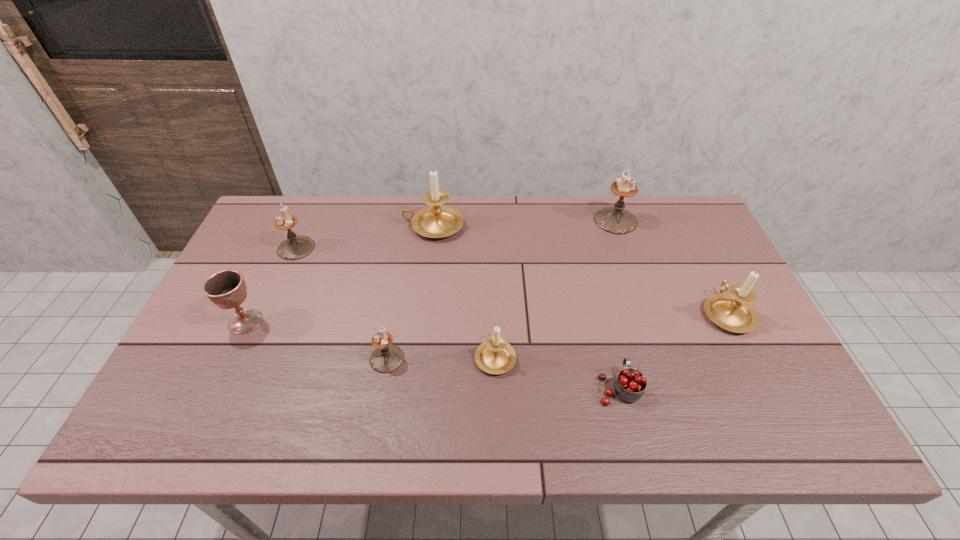
This screenshot has height=540, width=960. In order to click on the second object from right to left in this screenshot , I will do 616,220.

Locate an element on the screen. This screenshot has height=540, width=960. the fifth candle holder from left to right is located at coordinates (616, 220).

At what (x,y) coordinates should I click in order to perform the action: click on the leftmost beige candle holder. Please return your answer as a coordinate pair (x, y). Image resolution: width=960 pixels, height=540 pixels. Looking at the image, I should click on (437, 221).

This screenshot has height=540, width=960. I want to click on the farthest beige candle holder, so click(x=437, y=221).

Find the location of a particular element. This screenshot has width=960, height=540. the second nearest purple candle holder is located at coordinates (295, 247).

Locate an element on the screen. the second biggest purple candle holder is located at coordinates (295, 247).

The height and width of the screenshot is (540, 960). In order to click on the second smallest beige candle holder in this screenshot , I will do `click(732, 312)`.

This screenshot has width=960, height=540. Find the location of `the rightmost candle holder`. the rightmost candle holder is located at coordinates (732, 312).

The height and width of the screenshot is (540, 960). I want to click on chalice, so click(227, 289).

You are a GUI agent. You are given a task and a screenshot of the screen. Output one action in this format:
    pyautogui.click(x=<x>, y=<y>)
    Task: Click on the second beige candle holder from right to left
    
    Given the screenshot: What is the action you would take?
    pyautogui.click(x=495, y=356)